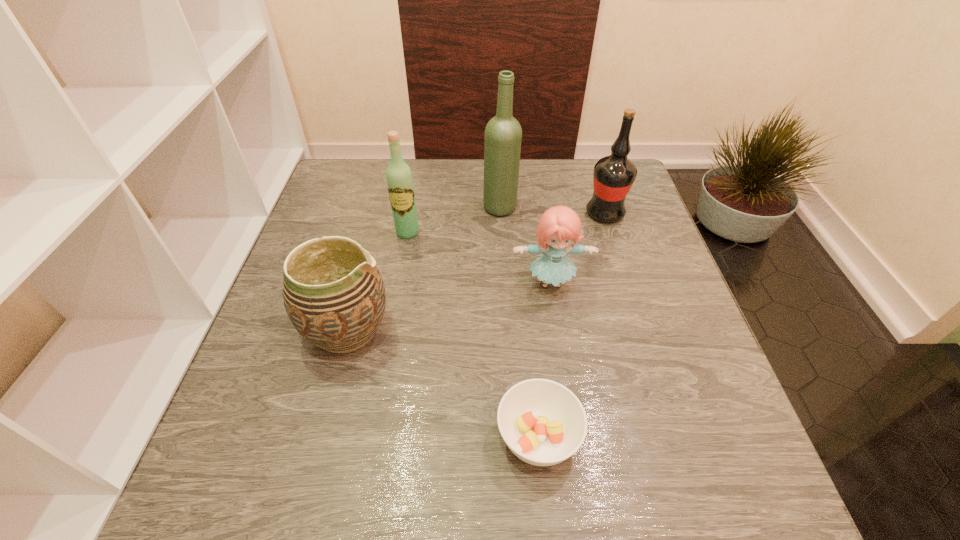
This screenshot has height=540, width=960. I want to click on object that is the fourth closest to the leftmost wine bottle, so click(613, 176).

Where is `wine bottle that is the closest to the doll`? wine bottle that is the closest to the doll is located at coordinates (613, 176).

Identify which wine bottle is the second closest to the rightmost object. Please provide its 2D coordinates. Your answer should be formatted as a tuple, i.e. [(x, y)], where the tuple contains the x and y coordinates of a point satisfying the conditions above.

[(399, 178)]

Find the location of a particular element. The image size is (960, 540). vacant space that satisfies the following two spatial constraints: 1. on the back side of the soup bowl; 2. on the left side of the rightmost object is located at coordinates (517, 214).

Where is `free point that satisfies the following two spatial constraints: 1. on the front-facing side of the shortest object; 2. on the right side of the leftmost wine bottle`? The width and height of the screenshot is (960, 540). free point that satisfies the following two spatial constraints: 1. on the front-facing side of the shortest object; 2. on the right side of the leftmost wine bottle is located at coordinates (372, 437).

You are a GUI agent. You are given a task and a screenshot of the screen. Output one action in this format:
    pyautogui.click(x=<x>, y=<y>)
    Task: Click on the vacant space that satisfies the following two spatial constraints: 1. on the front-facing side of the leftmost wine bottle; 2. on the left side of the shortest object
    
    Given the screenshot: What is the action you would take?
    click(372, 437)